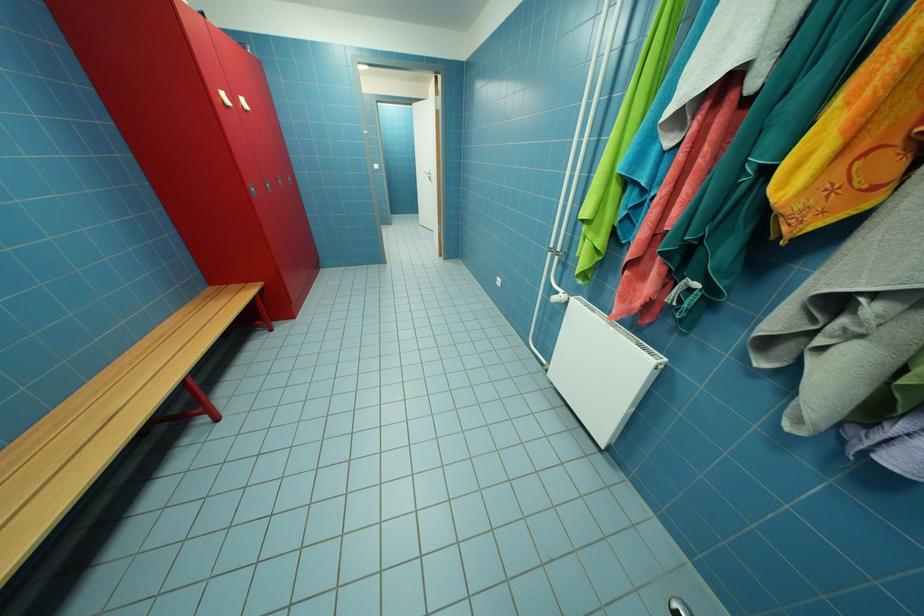
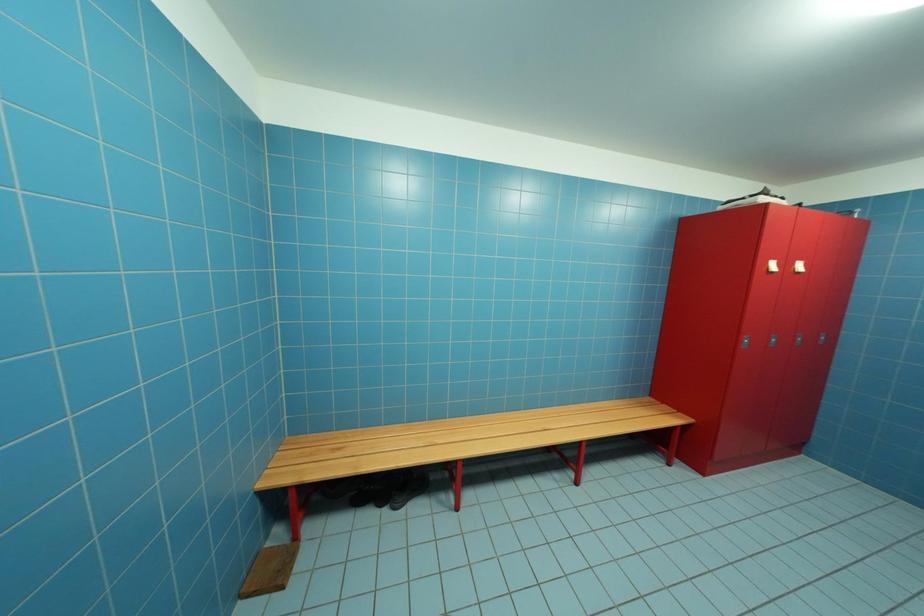
Question: The camera is either moving clockwise (left) or counter-clockwise (right) around the object. The first image is from the beginning of the video and the second image is from the end. Is the camera moving left or right when shooting the video?

Choices:
 (A) Left
 (B) Right

Answer: (B)